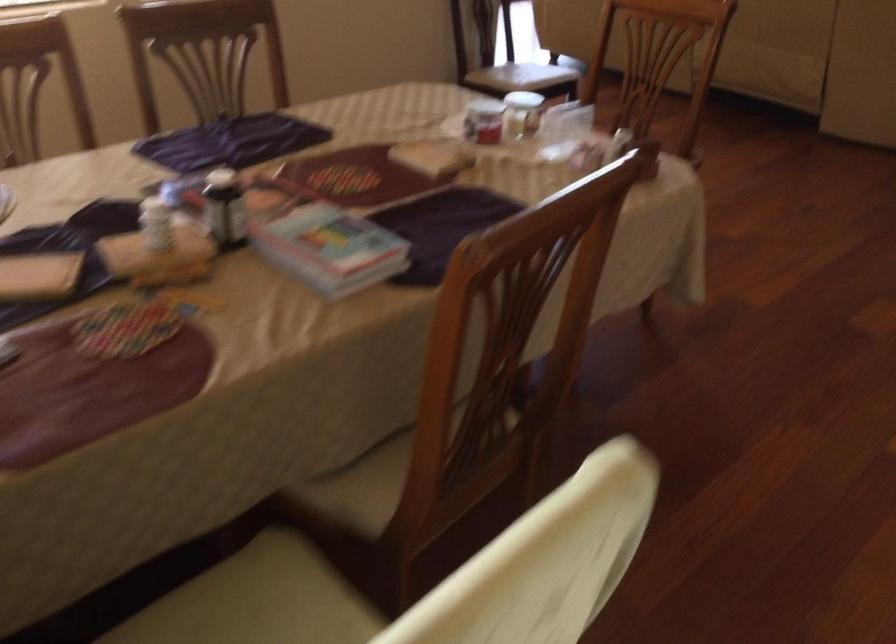
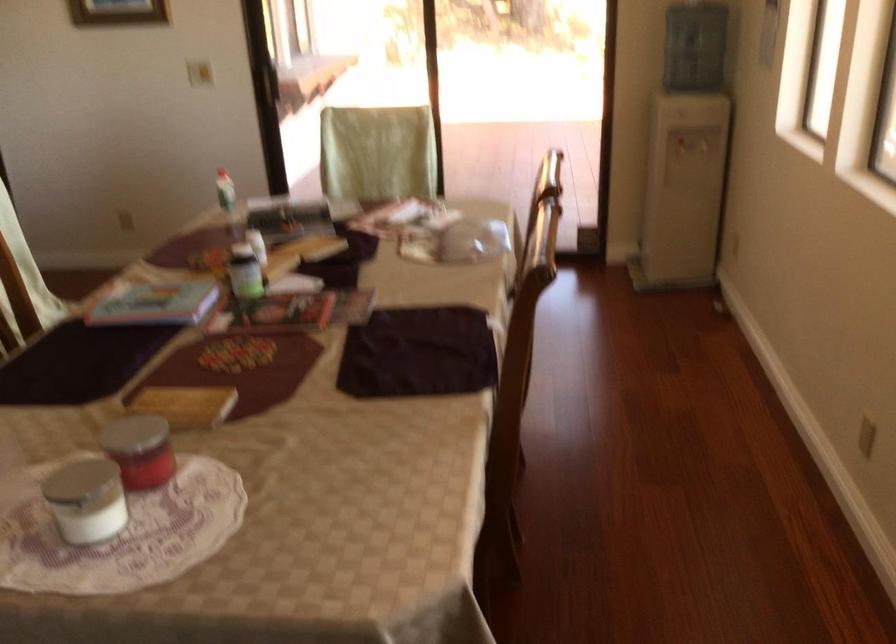
In the second image, find the point that corresponds to point (527, 100) in the first image.

(85, 500)